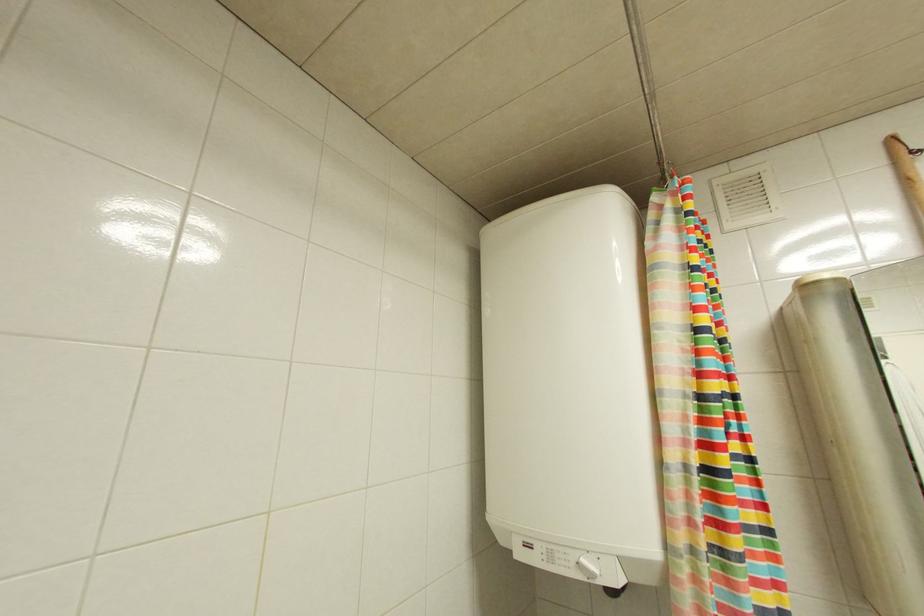
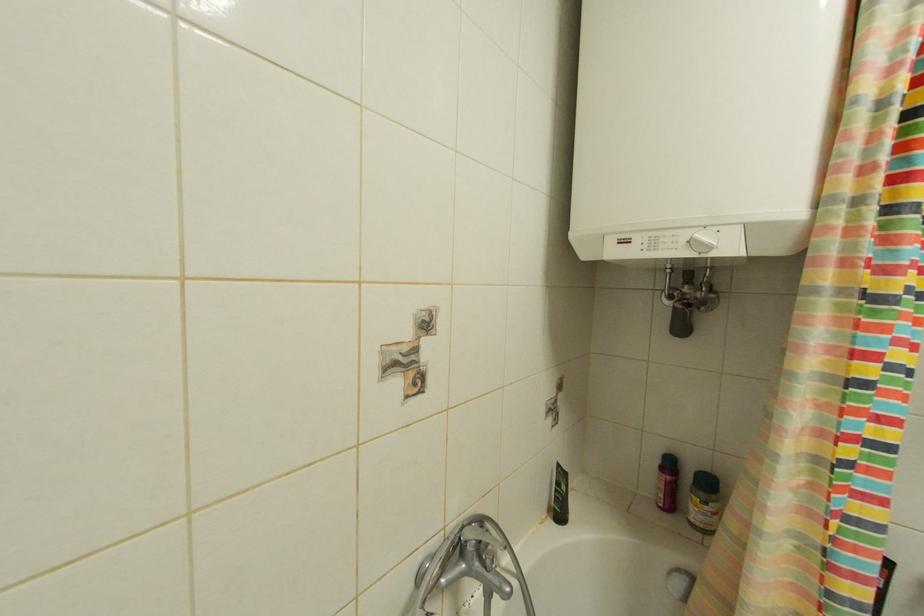
Question: The images are taken continuously from a first-person perspective. In which direction are you moving?

Choices:
 (A) Left
 (B) Right
 (C) Forward
 (D) Backward

Answer: (A)